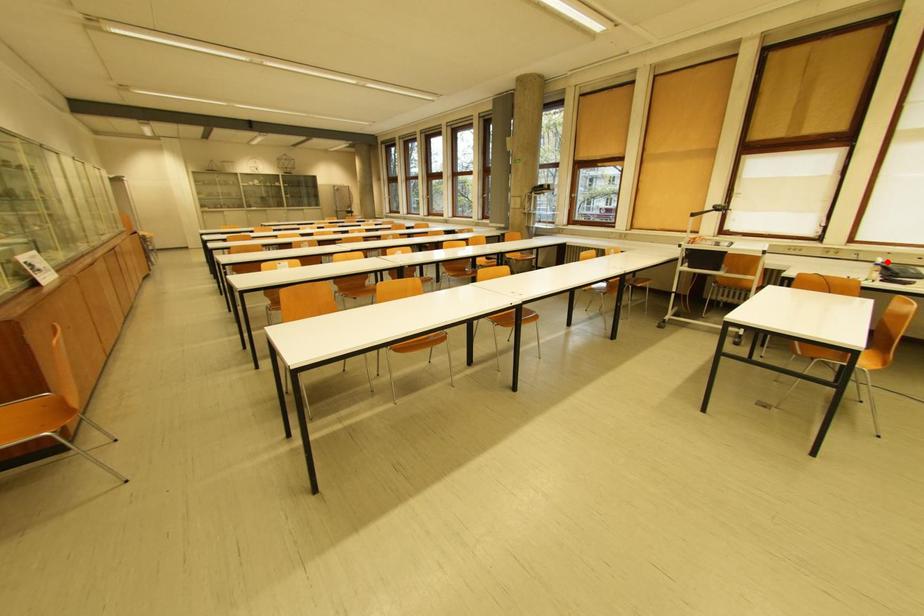
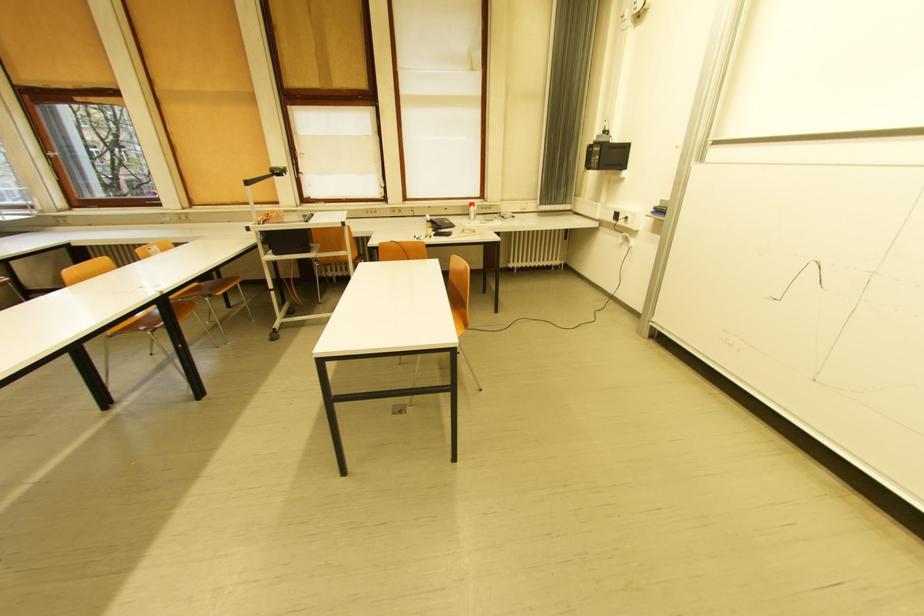
Where in the second image is the point corresponding to the highlighted location from the first image?

(434, 219)